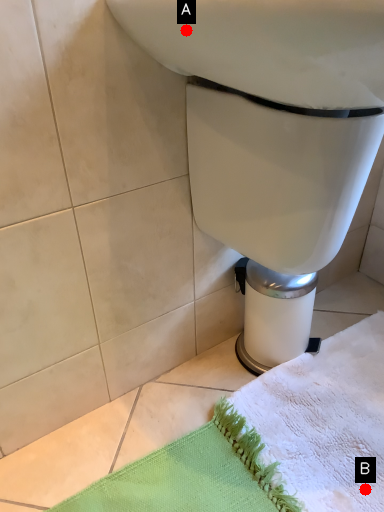
Question: Two points are circled on the image, labeled by A and B beside each circle. Which point appears closest to the camera in this image?

Choices:
 (A) A is closer
 (B) B is closer

Answer: (A)